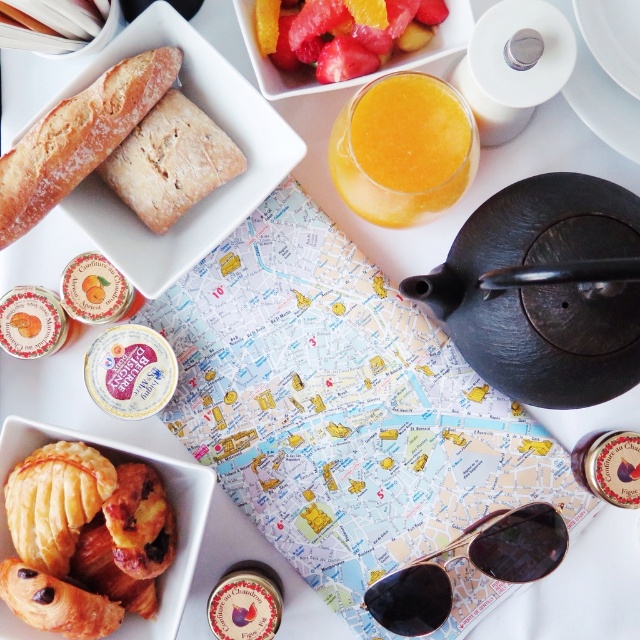
Is gold metallic sunglasses at center below golden flaky pastry at lower left?

Indeed, gold metallic sunglasses at center is positioned under golden flaky pastry at lower left.

Locate an element on the screen. gold metallic sunglasses at center is located at coordinates (472, 563).

Who is taller, shiny orange slices at center or white ceramic plate at upper right?

white ceramic plate at upper right

Does point (372, 29) lie behind point (602, 74)?

Yes, point (372, 29) is farther from viewer.

Locate an element on the screen. The image size is (640, 640). shiny orange slices at center is located at coordinates (340, 33).

Does slightly golden brown crusty croissant at upper left have a lesser width compared to white ceramic plate at upper right?

No, slightly golden brown crusty croissant at upper left is not thinner than white ceramic plate at upper right.

The height and width of the screenshot is (640, 640). What do you see at coordinates (77, 138) in the screenshot?
I see `slightly golden brown crusty croissant at upper left` at bounding box center [77, 138].

Where is `slightly golden brown crusty croissant at upper left`? This screenshot has height=640, width=640. slightly golden brown crusty croissant at upper left is located at coordinates (77, 138).